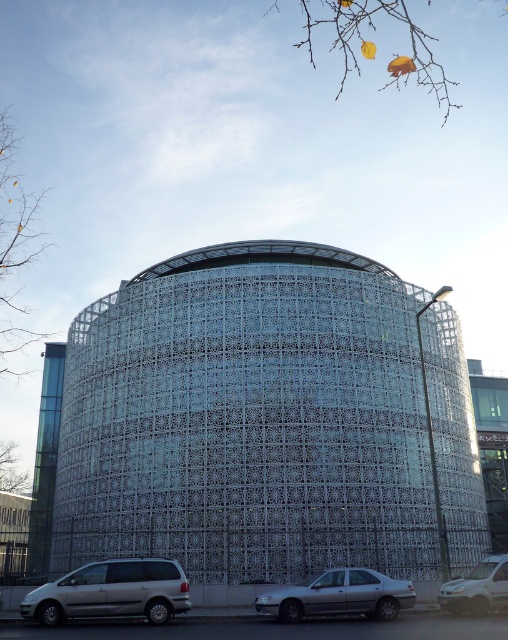
You are standing at the center of the street in front of the modern building with the rounded facade. You want to park your car in the closest available spot. The parking spots are marked at coordinates from 0.0 to 1.0 along the street. Your current position is at 0.5. The silver metallic van at lower left is blocking the path to the left side of the street. Can you safely drive to the right side of the street to park without passing the van?

Since the silver metallic van at lower left is positioned at 0.925 on the street coordinate, which is to the far right, and your current position is at 0.5, you can safely drive to the right side of the street to park without needing to pass the van as it is already on the right side.

You are a pedestrian standing on the sidewalk in front of the building. You need to cross the street to reach the other side. Which vehicle, the silver metallic van at lower left or the silver metallic car at lower center, is closer to the curb?

The silver metallic van at lower left is closer to the curb than the silver metallic car at lower center because it is positioned to the left of the silver metallic car at lower center, and in the street layout, vehicles parked to the left would typically be closer to the curb on that side.

You are standing at the entrance of the modern architectural structure and want to park your car. The parking spot you desire is at coordinates point A. The silver metallic van at lower left is currently blocking the path to point A. Can you determine if the van is positioned directly in front of point A based on its coordinates?

The silver metallic van at lower left is located at point A, so yes, it is directly blocking the path to point A.